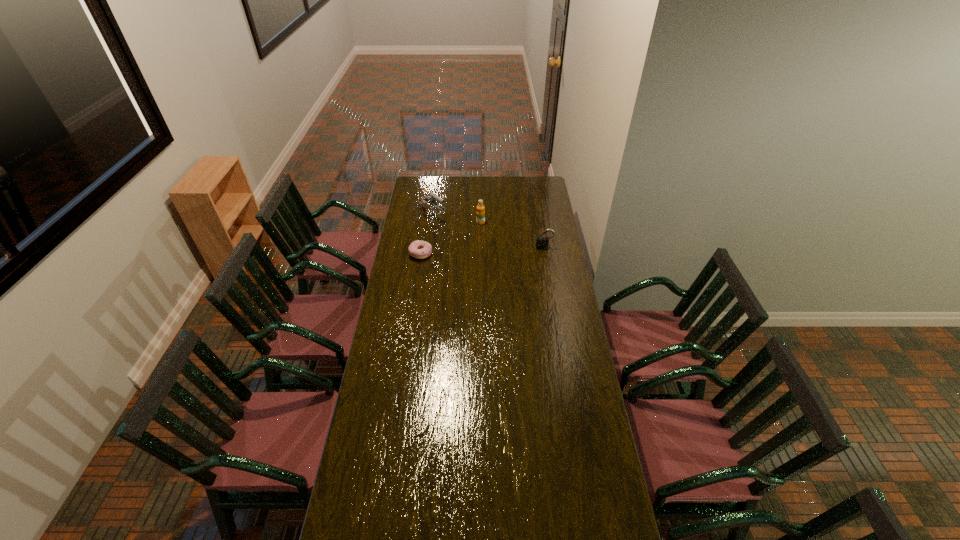
The width and height of the screenshot is (960, 540). What are the coordinates of `vacant area that lies between the orange juice and the gun` in the screenshot? It's located at (456, 220).

Select which object appears as the closest to the gun. Please provide its 2D coordinates. Your answer should be formatted as a tuple, i.e. [(x, y)], where the tuple contains the x and y coordinates of a point satisfying the conditions above.

[(480, 213)]

You are a GUI agent. You are given a task and a screenshot of the screen. Output one action in this format:
    pyautogui.click(x=<x>, y=<y>)
    Task: Click on the closest object relative to the padlock
    
    Given the screenshot: What is the action you would take?
    pyautogui.click(x=480, y=213)